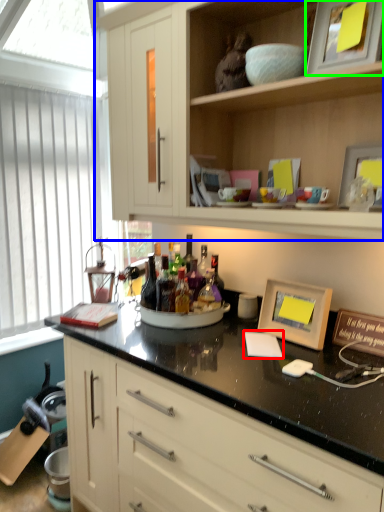
Question: Based on their relative distances, which object is nearer to notepad (highlighted by a red box)? Choose from cabinetry (highlighted by a blue box) and picture frame (highlighted by a green box).

Choices:
 (A) cabinetry
 (B) picture frame

Answer: (A)